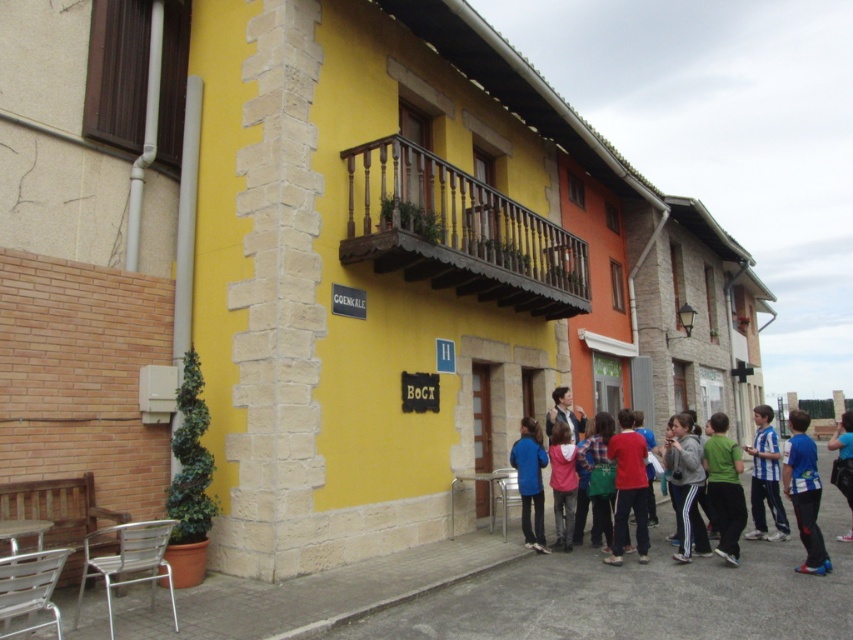
Can you confirm if green fabric shirt at center is wider than pink fabric shirt at center?

No.

Which of these two, green fabric shirt at center or pink fabric shirt at center, stands shorter?

Standing shorter between the two is pink fabric shirt at center.

Does point (708, 496) lie in front of point (560, 516)?

Yes, it is.

What are the coordinates of `green fabric shirt at center` in the screenshot? It's located at pos(724,486).

What do you see at coordinates (764, 477) in the screenshot? I see `blue and white striped shirt at right` at bounding box center [764, 477].

Looking at this image, measure the distance from blue and white striped shirt at right to pink fabric shirt at center.

blue and white striped shirt at right and pink fabric shirt at center are 2.94 meters apart from each other.

Where is `blue and white striped shirt at right`? This screenshot has height=640, width=853. blue and white striped shirt at right is located at coordinates (x=764, y=477).

Where is `blue and white striped shirt at right`? blue and white striped shirt at right is located at coordinates (764, 477).

Does wooden at upper center appear on the right side of blue fabric jacket at center?

Incorrect, wooden at upper center is not on the right side of blue fabric jacket at center.

Does wooden at upper center have a lesser width compared to blue fabric jacket at center?

In fact, wooden at upper center might be wider than blue fabric jacket at center.

The image size is (853, 640). Describe the element at coordinates (457, 232) in the screenshot. I see `wooden at upper center` at that location.

Locate an element on the screen. This screenshot has height=640, width=853. wooden at upper center is located at coordinates (457, 232).